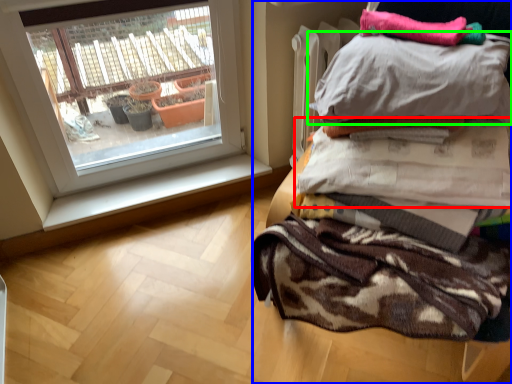
Question: Estimate the real-world distances between objects in this image. Which object is farther from blanket (highlighted by a red box), furniture (highlighted by a blue box) or pillow (highlighted by a green box)?

Choices:
 (A) furniture
 (B) pillow

Answer: (A)